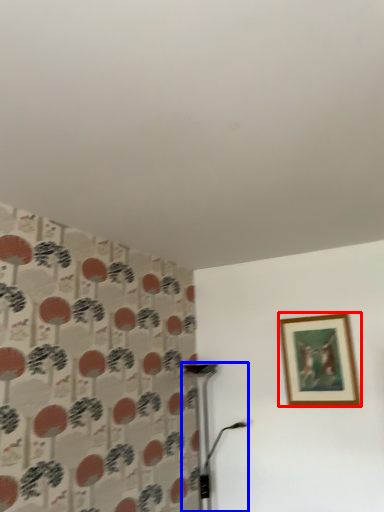
Question: Which object appears farthest to the camera in this image, picture frame (highlighted by a red box) or table lamp (highlighted by a blue box)?

Choices:
 (A) picture frame
 (B) table lamp

Answer: (A)